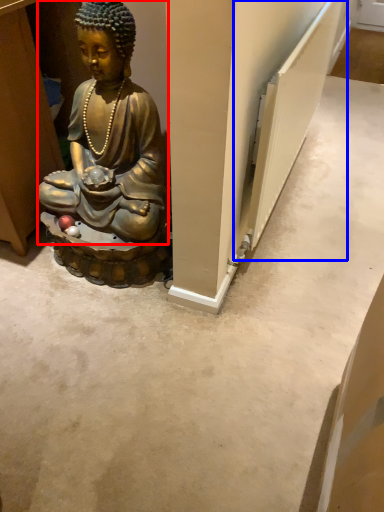
Question: Which point is closer to the camera, person (highlighted by a red box) or radiator (highlighted by a blue box)?

Choices:
 (A) person
 (B) radiator

Answer: (A)